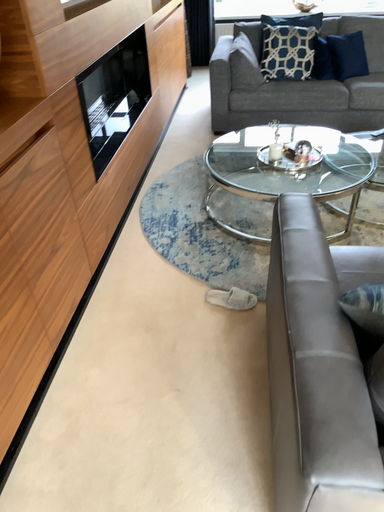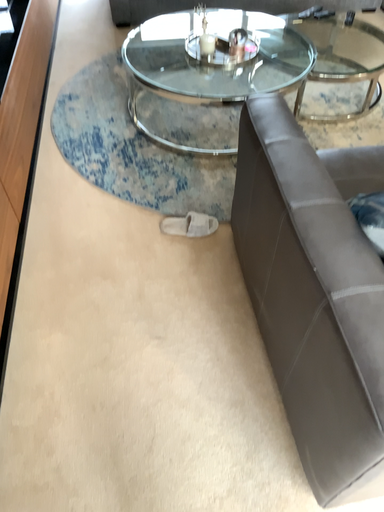
Question: How did the camera likely rotate when shooting the video?

Choices:
 (A) rotated downward
 (B) rotated upward

Answer: (A)